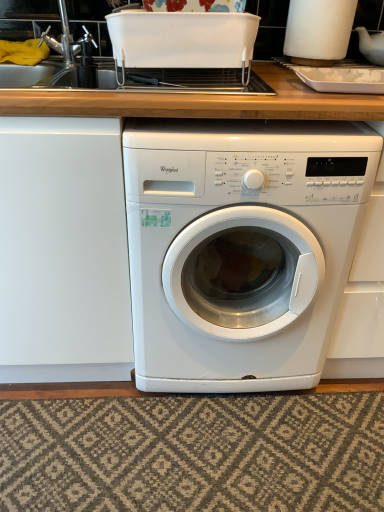
Question: Does textured beige rug at lower center have a greater height compared to white glossy washing machine at center?

Choices:
 (A) no
 (B) yes

Answer: (A)

Question: From a real-world perspective, is textured beige rug at lower center located higher than white glossy washing machine at center?

Choices:
 (A) yes
 (B) no

Answer: (B)

Question: Does textured beige rug at lower center appear on the left side of white glossy washing machine at center?

Choices:
 (A) no
 (B) yes

Answer: (B)

Question: Is textured beige rug at lower center positioned in front of white glossy washing machine at center?

Choices:
 (A) yes
 (B) no

Answer: (B)

Question: From a real-world perspective, is textured beige rug at lower center physically below white glossy washing machine at center?

Choices:
 (A) no
 (B) yes

Answer: (B)

Question: From the image's perspective, is textured beige rug at lower center located above or below white glossy container at upper right, which appears as the 1th appliance when viewed from the right?

Choices:
 (A) above
 (B) below

Answer: (B)

Question: Is point (64, 430) positioned closer to the camera than point (331, 56)?

Choices:
 (A) closer
 (B) farther

Answer: (B)

Question: Is textured beige rug at lower center situated inside white glossy container at upper right, which is the second appliance in left-to-right order, or outside?

Choices:
 (A) outside
 (B) inside

Answer: (A)

Question: Considering the positions of textured beige rug at lower center and white glossy container at upper right, which appears as the 1th appliance when viewed from the right, in the image, is textured beige rug at lower center wider or thinner than white glossy container at upper right, which appears as the 1th appliance when viewed from the right,?

Choices:
 (A) thin
 (B) wide

Answer: (B)

Question: In the image, is white glossy container at upper right, which appears as the 1th appliance when viewed from the right, positioned in front of or behind white glossy washing machine at center?

Choices:
 (A) behind
 (B) front

Answer: (A)

Question: Looking at the image, does white glossy container at upper right, which is the second appliance in left-to-right order, seem bigger or smaller compared to white glossy washing machine at center?

Choices:
 (A) big
 (B) small

Answer: (B)

Question: Would you say white glossy container at upper right, which appears as the 1th appliance when viewed from the right, is to the left or to the right of white glossy washing machine at center in the picture?

Choices:
 (A) left
 (B) right

Answer: (B)

Question: Do you think white glossy container at upper right, which is the second appliance in left-to-right order, is within white glossy washing machine at center, or outside of it?

Choices:
 (A) outside
 (B) inside

Answer: (A)

Question: Does point (375, 453) appear closer or farther from the camera than point (360, 156)?

Choices:
 (A) closer
 (B) farther

Answer: (B)

Question: Considering the relative positions of textured beige rug at lower center and white glossy washing machine at center in the image provided, is textured beige rug at lower center to the left or to the right of white glossy washing machine at center?

Choices:
 (A) right
 (B) left

Answer: (B)